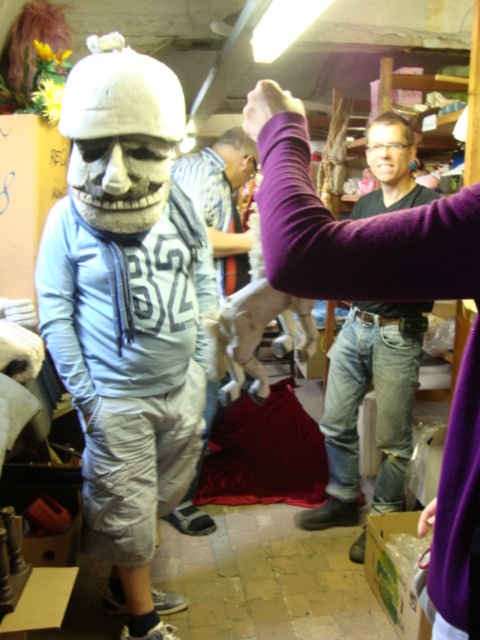
Does matte black shirt at center have a greater width compared to white matte skull at center?

Indeed, matte black shirt at center has a greater width compared to white matte skull at center.

Which is below, matte black shirt at center or white matte skull at center?

Positioned lower is matte black shirt at center.

Does point (414, 352) come in front of point (66, 99)?

No.

You are a GUI agent. You are given a task and a screenshot of the screen. Output one action in this format:
    pyautogui.click(x=<x>, y=<y>)
    Task: Click on the matte black shirt at center
    This screenshot has width=480, height=640.
    Given the screenshot: What is the action you would take?
    pyautogui.click(x=375, y=406)

What do you see at coordinates (128, 312) in the screenshot? I see `matte white mask at center` at bounding box center [128, 312].

Can you confirm if matte white mask at center is positioned below white matte skull at center?

Yes.

Which is behind, point (90, 419) or point (117, 204)?

The point (90, 419) is more distant.

I want to click on matte white mask at center, so click(128, 312).

Between matte black shirt at center and light blue fabric shirt at center, which one has less height?

Standing shorter between the two is light blue fabric shirt at center.

Describe the element at coordinates (375, 406) in the screenshot. I see `matte black shirt at center` at that location.

Identify the location of matte black shirt at center. Image resolution: width=480 pixels, height=640 pixels. (375, 406).